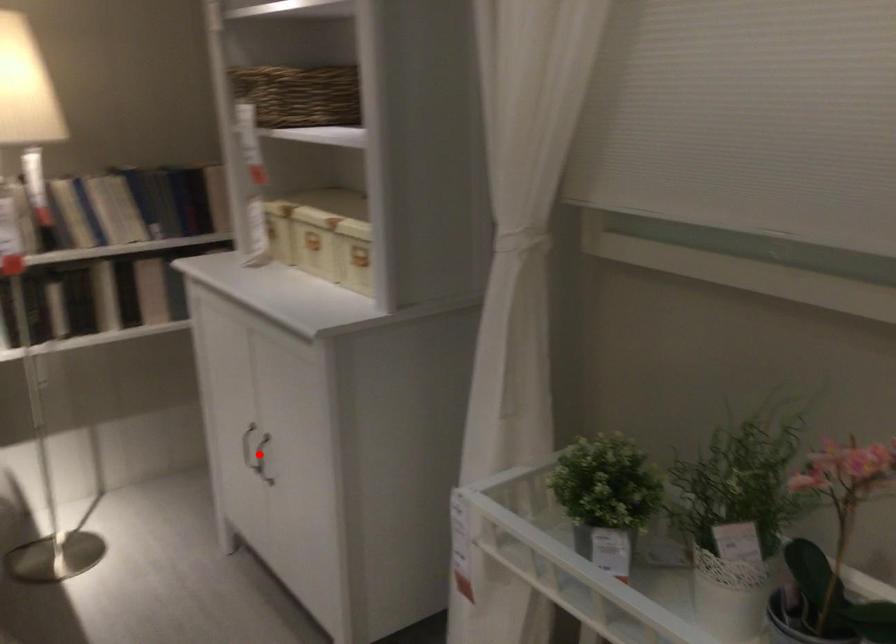
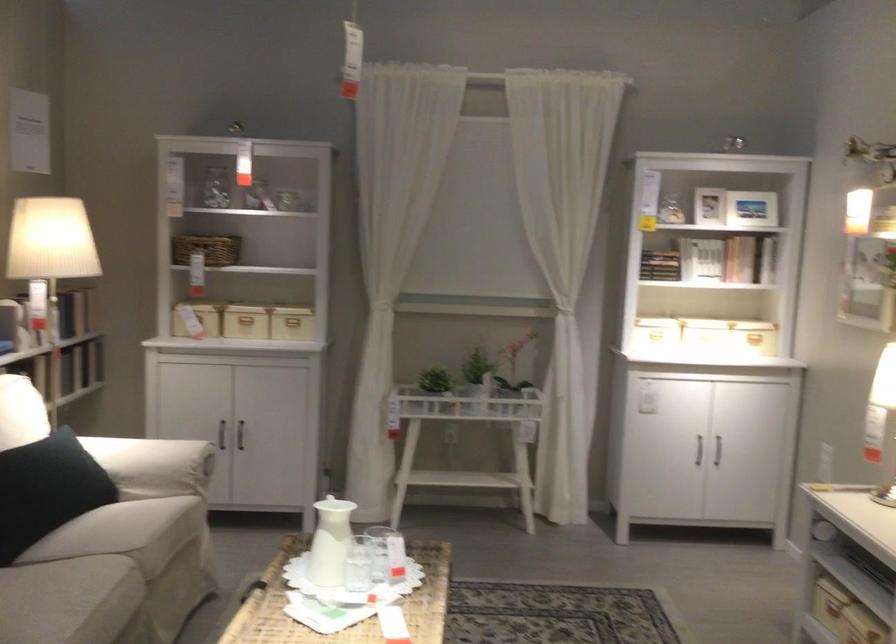
Find the pixel in the second image that matches the highlighted location in the first image.

(240, 435)